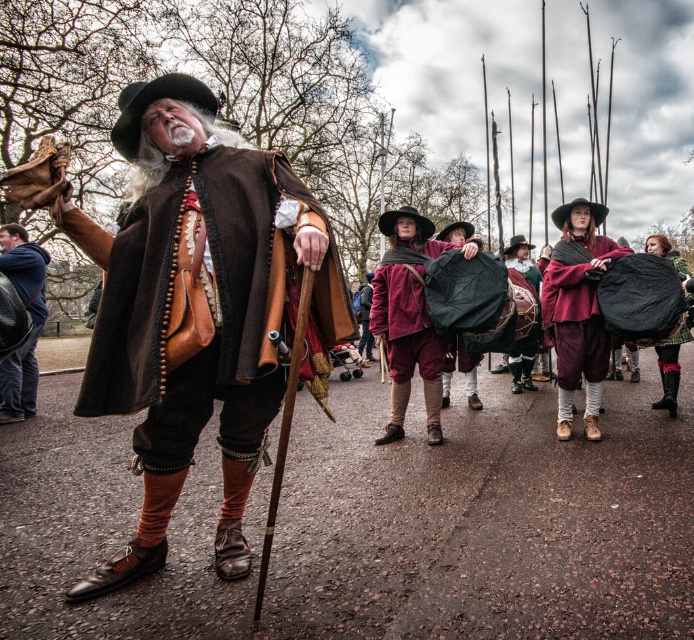
Question: Does matte purple tunic at center have a larger size compared to matte brown leather bag at left?

Choices:
 (A) no
 (B) yes

Answer: (B)

Question: Which of the following is the farthest from the observer?

Choices:
 (A) (586, 387)
 (B) (393, 365)

Answer: (A)

Question: Can you confirm if maroon fabric cape at center is bigger than matte purple tunic at center?

Choices:
 (A) no
 (B) yes

Answer: (A)

Question: Among these points, which one is nearest to the camera?

Choices:
 (A) (37, 333)
 (B) (672, 364)
 (C) (564, 352)
 (D) (387, 346)

Answer: (C)

Question: Does matte purple tunic at center have a greater width compared to matte brown leather bag at left?

Choices:
 (A) yes
 (B) no

Answer: (A)

Question: Which of the following is the farthest from the observer?

Choices:
 (A) (670, 396)
 (B) (42, 316)

Answer: (B)